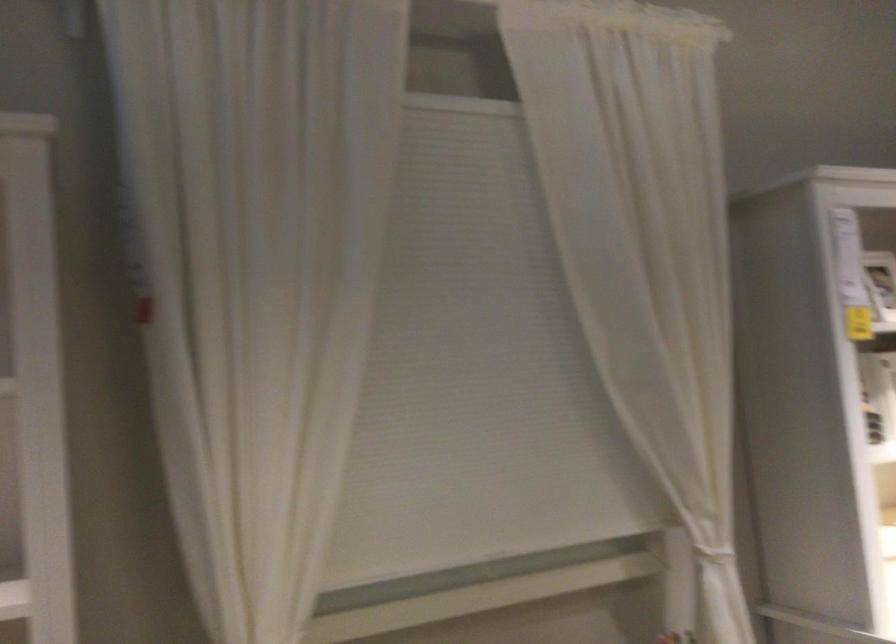
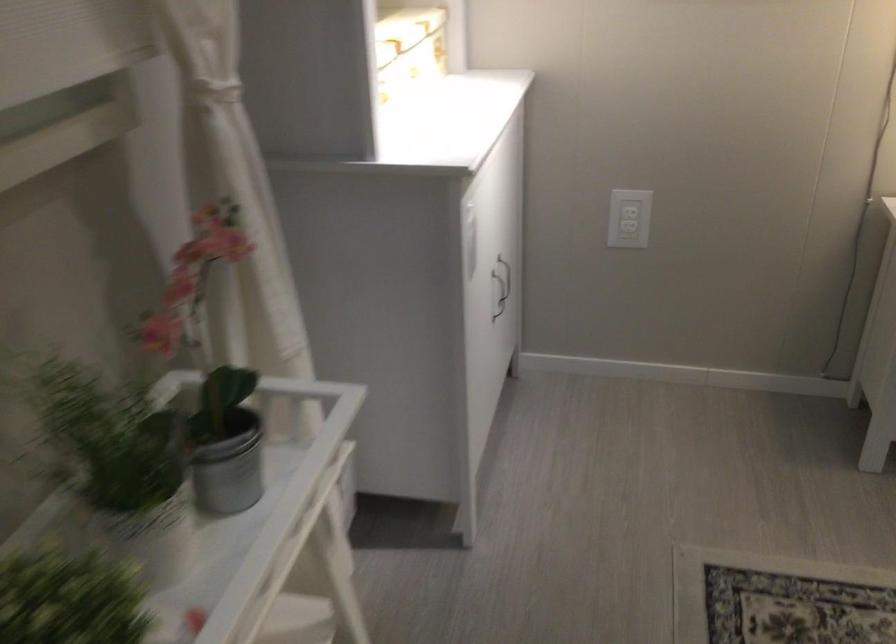
First-person continuous shooting, in which direction is the camera rotating?

The camera rotated toward right-down.